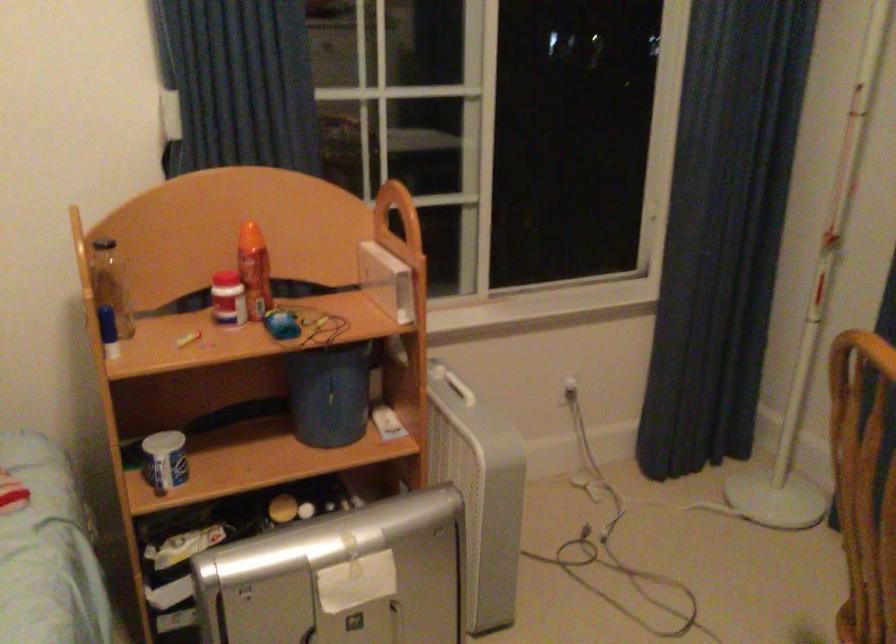
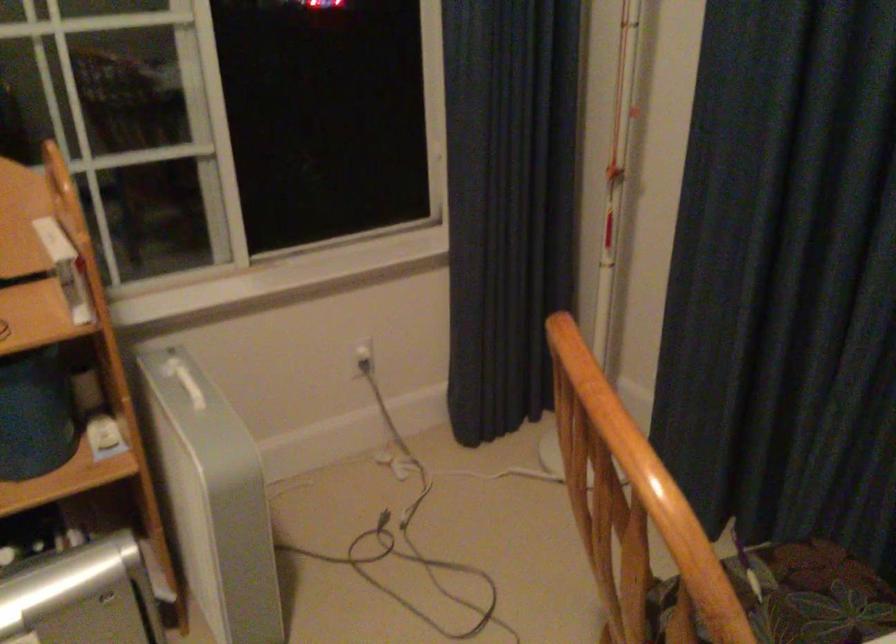
Question: The camera is either moving clockwise (left) or counter-clockwise (right) around the object. The first image is from the beginning of the video and the second image is from the end. Is the camera moving left or right when shooting the video?

Choices:
 (A) Left
 (B) Right

Answer: (A)